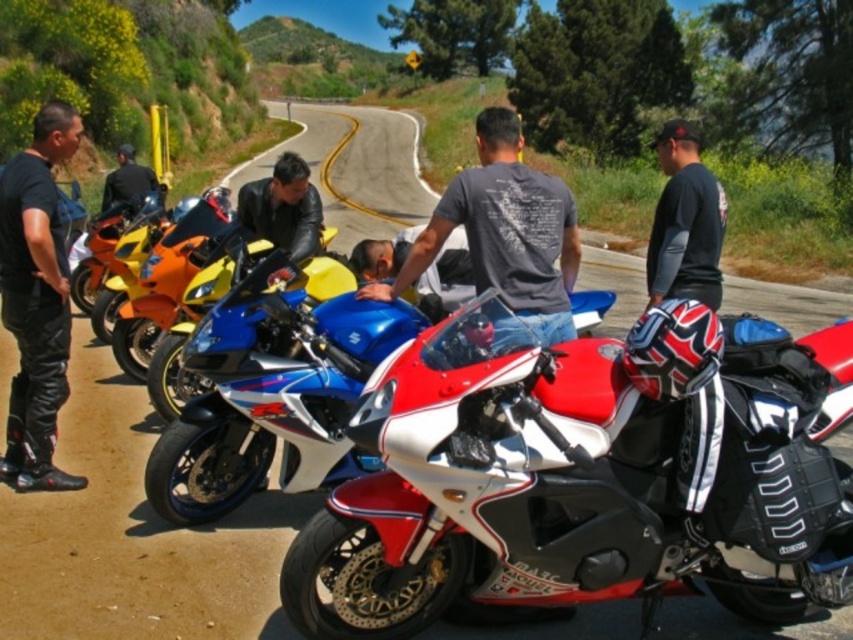
You are a photographer standing at the starting line of a motorcycle rally. You want to take a photo of the shiny red and white motorcycle at center and the leather jacket at center so that both are clearly visible. Based on their positions, which object should you focus on first to ensure both are in frame?

The shiny red and white motorcycle at center is in front of the leather jacket at center, so you should focus on the shiny red and white motorcycle at center first to ensure both are in frame.